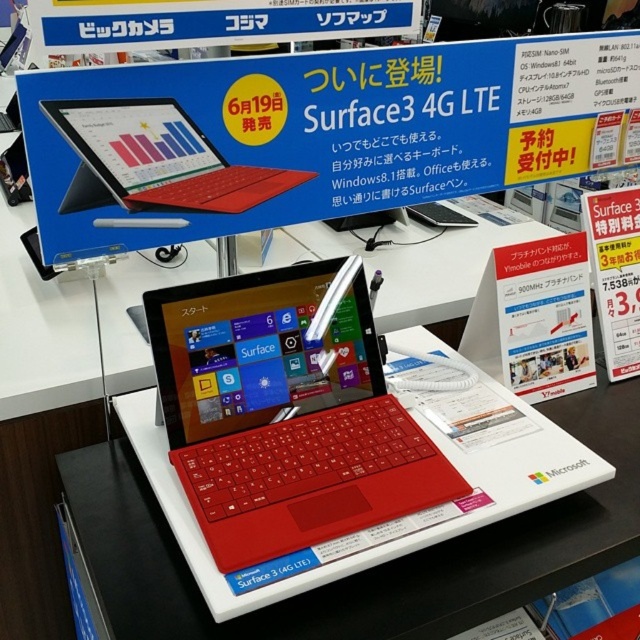
Is point (96, 470) more distant than point (106, 115)?

Yes, it is.

Describe the element at coordinates (369, 568) in the screenshot. The height and width of the screenshot is (640, 640). I see `white plastic table at center` at that location.

Is point (579, 512) in front of point (291, 173)?

Yes.

The width and height of the screenshot is (640, 640). I want to click on white plastic table at center, so click(x=369, y=568).

Can you confirm if matte red laptop at center is thinner than white plastic table at center?

Correct, matte red laptop at center's width is less than white plastic table at center's.

Measure the distance between matte red laptop at center and white plastic table at center.

A distance of 8.19 inches exists between matte red laptop at center and white plastic table at center.

Is point (220, 436) in front of point (582, 564)?

No, (220, 436) is further to viewer.

The height and width of the screenshot is (640, 640). I want to click on matte red laptop at center, so click(284, 413).

Is matte red laptop at center wider than matte red laptop at upper center?

Yes.

Does matte red laptop at center come behind matte red laptop at upper center?

No, matte red laptop at center is in front of matte red laptop at upper center.

You are a GUI agent. You are given a task and a screenshot of the screen. Output one action in this format:
    pyautogui.click(x=<x>, y=<y>)
    Task: Click on the matte red laptop at center
    This screenshot has height=640, width=640.
    Given the screenshot: What is the action you would take?
    pyautogui.click(x=284, y=413)